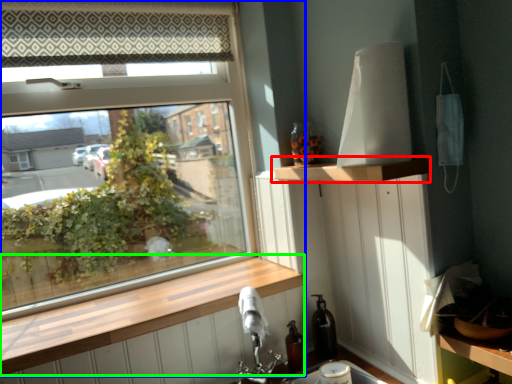
Question: Based on their relative distances, which object is nearer to shelf (highlighted by a red box)? Choose from window (highlighted by a blue box) and window sill (highlighted by a green box).

Choices:
 (A) window
 (B) window sill

Answer: (B)